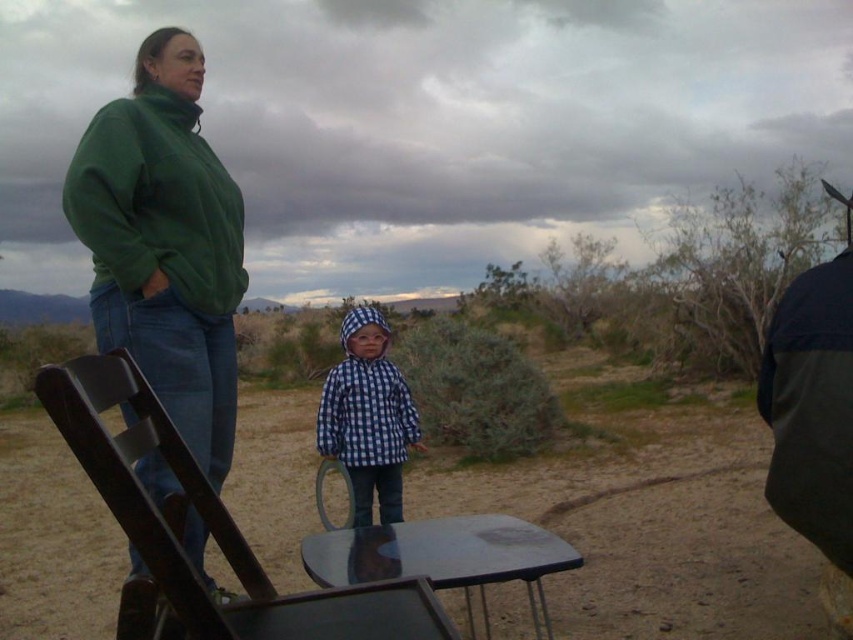
From the picture: You are planning to set up a small campsite in the desert. You have a wooden folding chair at center and a dark green jacket at right. Which object is taller, and how does this help in deciding where to place them?

The wooden folding chair at center is much taller than the dark green jacket at right. This means the chair should be placed in an area where its height won

You are a hiker trying to identify the smaller jacket between the green fleece jacket at upper left and the blue checkered jacket at center. Which one should you point out?

The green fleece jacket at upper left has a smaller size compared to the blue checkered jacket at center, so you should point out the green fleece jacket at upper left.

You are an observer in this outdoor scene. You notice the green fleece sweatshirt at upper left and the blue checkered jacket at center. Which of these two items is smaller in size?

The green fleece sweatshirt at upper left is smaller than the blue checkered jacket at center according to the description.